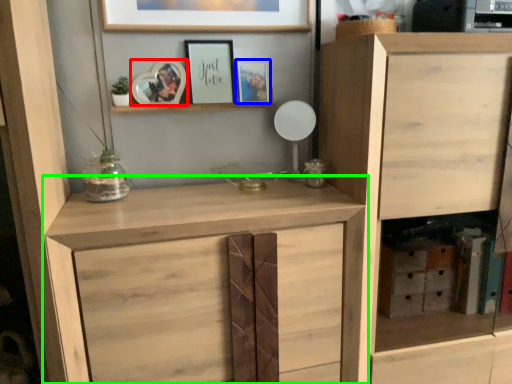
Question: Which object is positioned closest to picture frame (highlighted by a red box)? Select from picture frame (highlighted by a blue box) and cupboard (highlighted by a green box).

Choices:
 (A) picture frame
 (B) cupboard

Answer: (A)